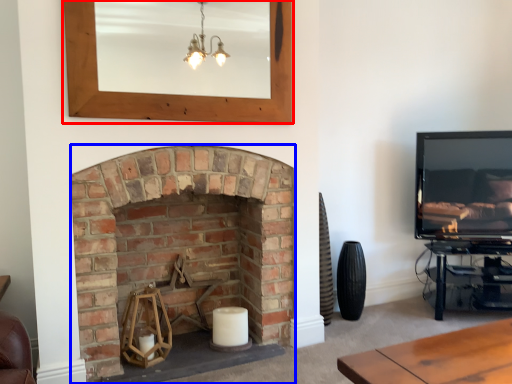
Question: Among these objects, which one is farthest to the camera, picture frame (highlighted by a red box) or fireplace (highlighted by a blue box)?

Choices:
 (A) picture frame
 (B) fireplace

Answer: (B)